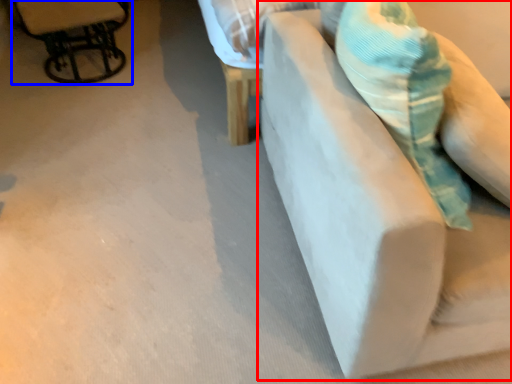
Question: Which of the following is the farthest to the observer, furniture (highlighted by a red box) or chair (highlighted by a blue box)?

Choices:
 (A) furniture
 (B) chair

Answer: (B)